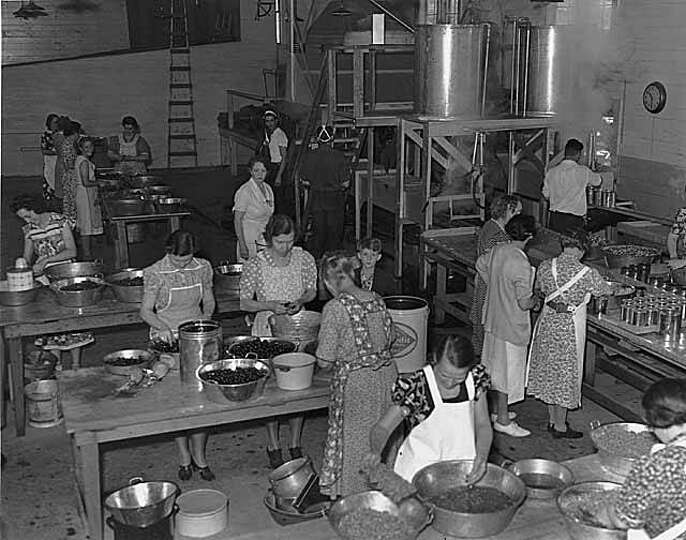
Image resolution: width=686 pixels, height=540 pixels. I want to click on tables, so click(x=145, y=413), click(x=110, y=310), click(x=134, y=214), click(x=302, y=528).